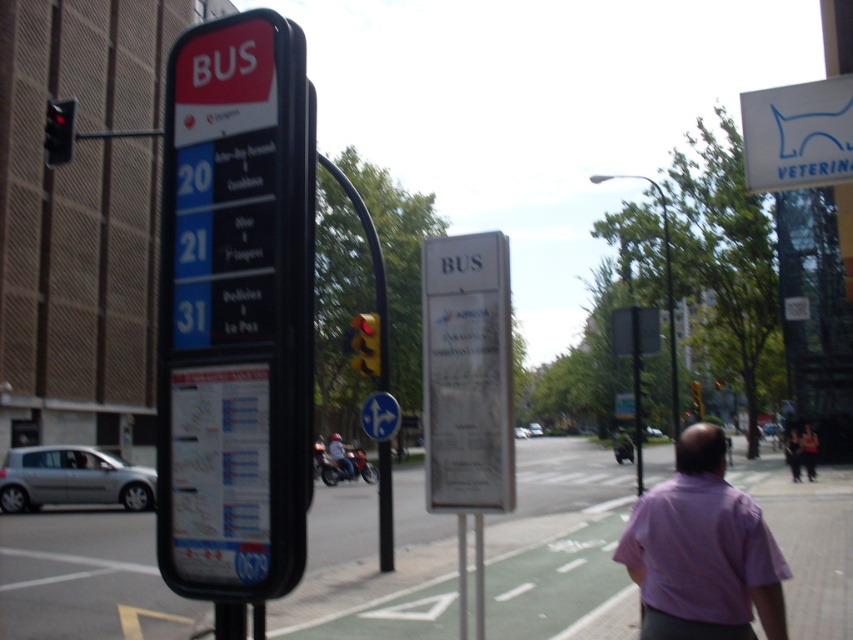
Question: Does purple cotton shirt at lower right have a lesser width compared to pink fabric shirt at lower right?

Choices:
 (A) no
 (B) yes

Answer: (A)

Question: Which point is farther to the camera?

Choices:
 (A) pink cotton shirt at lower right
 (B) purple cotton shirt at lower right
 (C) green asphalt pavement at lower center

Answer: (A)

Question: Is pink cotton shirt at lower right bigger than pink fabric shirt at lower right?

Choices:
 (A) no
 (B) yes

Answer: (A)

Question: Can you confirm if white plastic bus stop sign at left is smaller than pink fabric shirt at lower right?

Choices:
 (A) no
 (B) yes

Answer: (B)

Question: Which point is farther to the camera?

Choices:
 (A) (653, 486)
 (B) (786, 460)
 (C) (392, 417)
 (D) (302, 426)

Answer: (B)

Question: Which object appears farthest from the camera in this image?

Choices:
 (A) blue glossy traffic sign at center
 (B) green asphalt pavement at lower center
 (C) pink fabric shirt at lower right

Answer: (C)